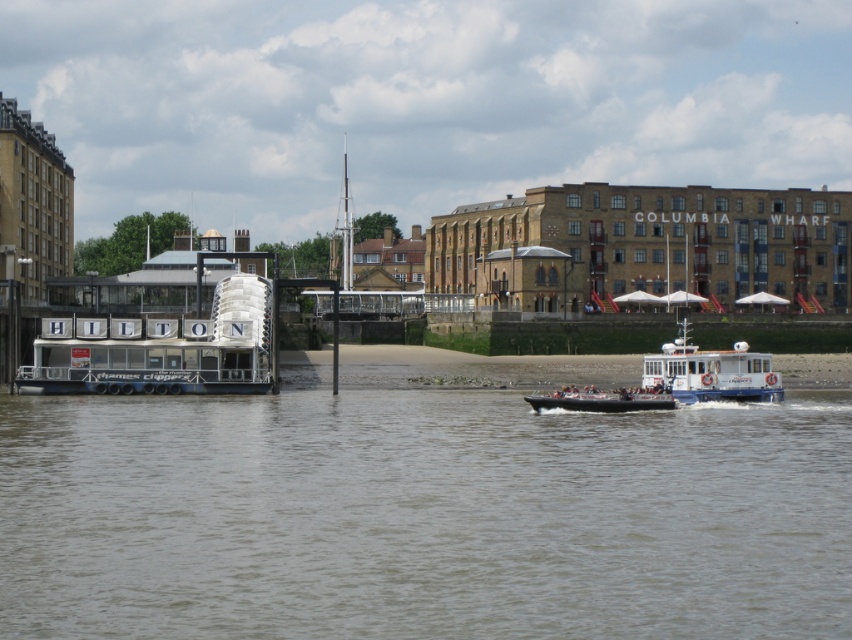
Question: Based on their relative distances, which object is farther from the white plastic boat at center?

Choices:
 (A) white plastic boat at center-right
 (B) white matte boat at left

Answer: (B)

Question: Does white matte boat at left come behind white plastic boat at center?

Choices:
 (A) yes
 (B) no

Answer: (A)

Question: Among these points, which one is nearest to the camera?

Choices:
 (A) (203, 372)
 (B) (603, 465)
 (C) (642, 397)

Answer: (B)

Question: Does white matte boat at left have a greater width compared to white plastic boat at center-right?

Choices:
 (A) yes
 (B) no

Answer: (A)

Question: Which point is farther to the camera?

Choices:
 (A) (521, 582)
 (B) (240, 323)
 (C) (769, 380)
 (D) (612, 397)

Answer: (B)

Question: From the image, what is the correct spatial relationship of brown water at center in relation to white plastic boat at center-right?

Choices:
 (A) left
 (B) right

Answer: (A)